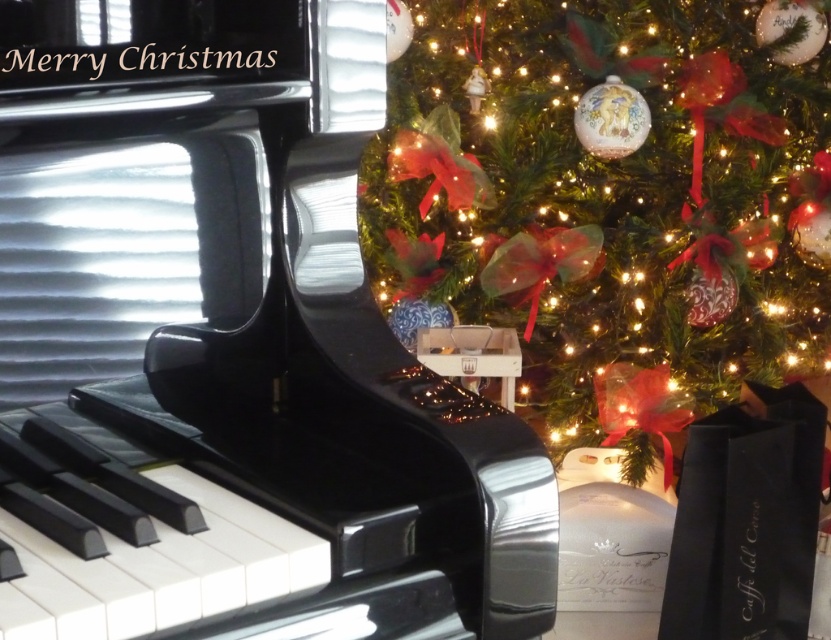
Is glossy black piano at center behind green matte christmas tree at upper right?

No, glossy black piano at center is in front of green matte christmas tree at upper right.

At what (x,y) coordinates should I click in order to perform the action: click on glossy black piano at center. Please return your answer as a coordinate pair (x, y). The image size is (831, 640). Looking at the image, I should click on (234, 356).